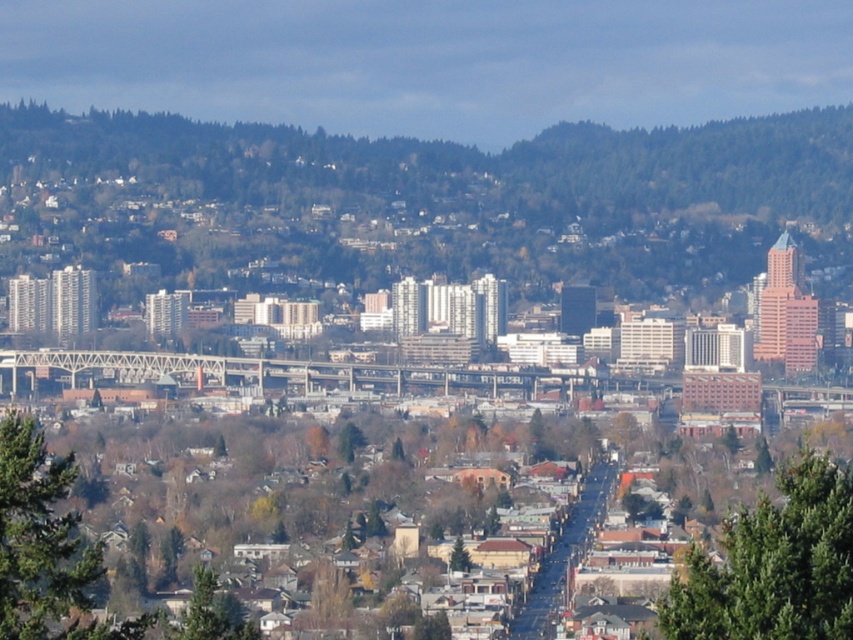
Question: Estimate the real-world distances between objects in this image. Which object is closer to the green leafy tree at center?

Choices:
 (A) green forested mountain at center
 (B) green leafy tree at lower left

Answer: (A)

Question: Which point is closer to the camera?

Choices:
 (A) (56, 602)
 (B) (457, 544)
 (C) (804, 154)

Answer: (B)

Question: Is green leafy tree at lower left smaller than green leafy tree at center?

Choices:
 (A) no
 (B) yes

Answer: (A)

Question: From the image, what is the correct spatial relationship of green textured tree at lower right in relation to green leafy tree at center?

Choices:
 (A) left
 (B) right

Answer: (B)

Question: Estimate the real-world distances between objects in this image. Which object is farther from the green forested mountain at center?

Choices:
 (A) green leafy tree at center
 (B) green textured tree at lower right
 (C) green leafy tree at lower left

Answer: (A)

Question: Considering the relative positions of green textured tree at lower right and green leafy tree at lower left in the image provided, where is green textured tree at lower right located with respect to green leafy tree at lower left?

Choices:
 (A) left
 (B) right

Answer: (B)